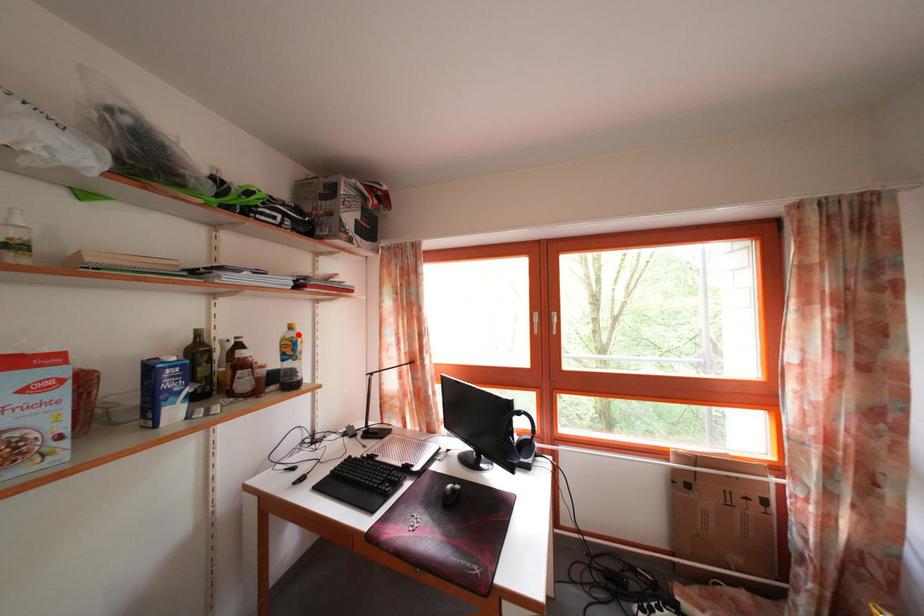
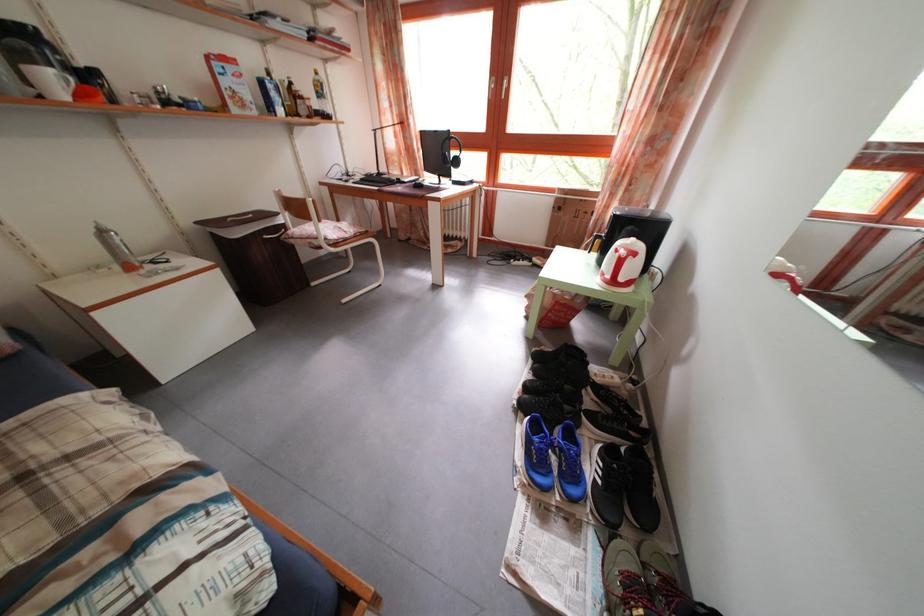
Locate, in the second image, the point that corresponds to the highlighted location in the first image.

(323, 79)